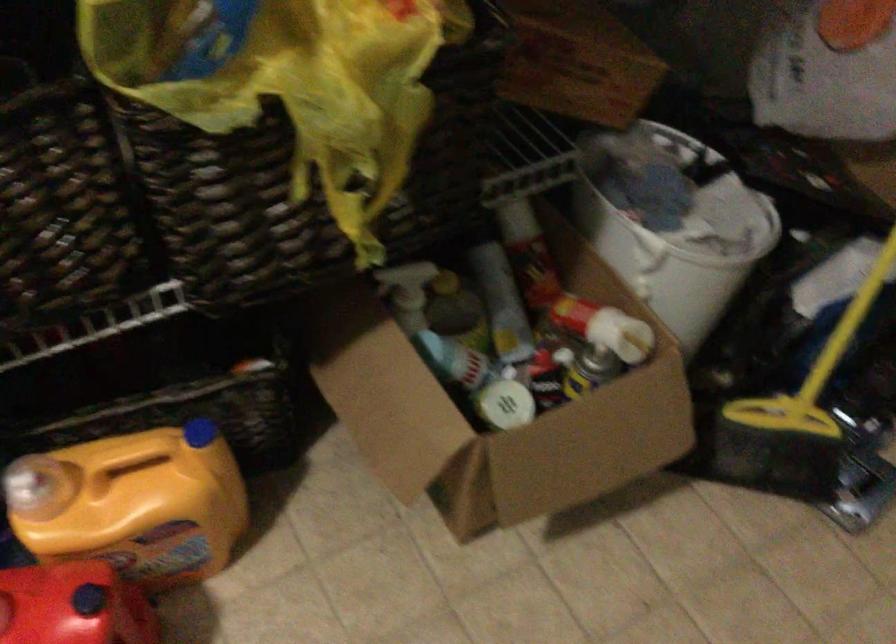
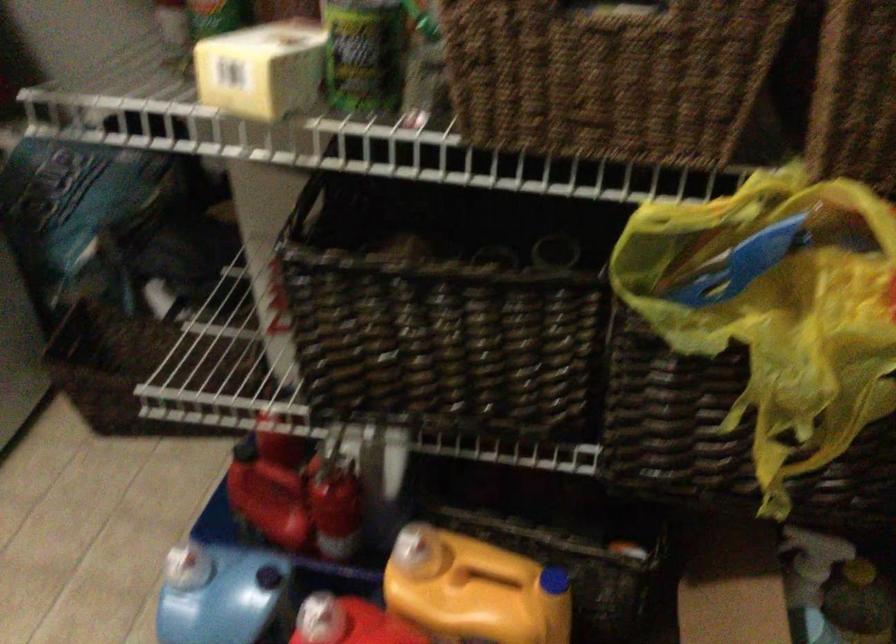
Where in the second image is the point corresponding to [130,486] from the first image?

(474, 590)